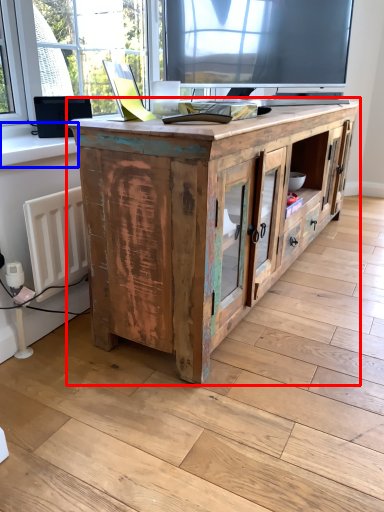
Question: Which object appears farthest to the camera in this image, cabinetry (highlighted by a red box) or window sill (highlighted by a blue box)?

Choices:
 (A) cabinetry
 (B) window sill

Answer: (B)